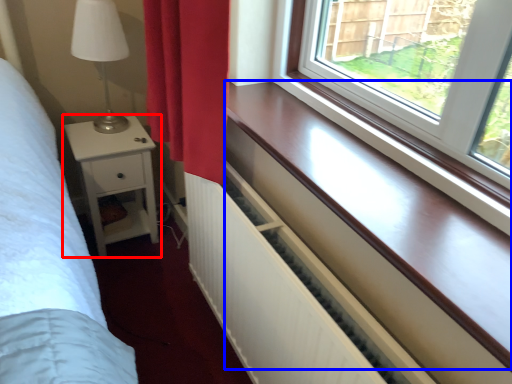
Question: Which object is closer to the camera taking this photo, nightstand (highlighted by a red box) or window sill (highlighted by a blue box)?

Choices:
 (A) nightstand
 (B) window sill

Answer: (B)